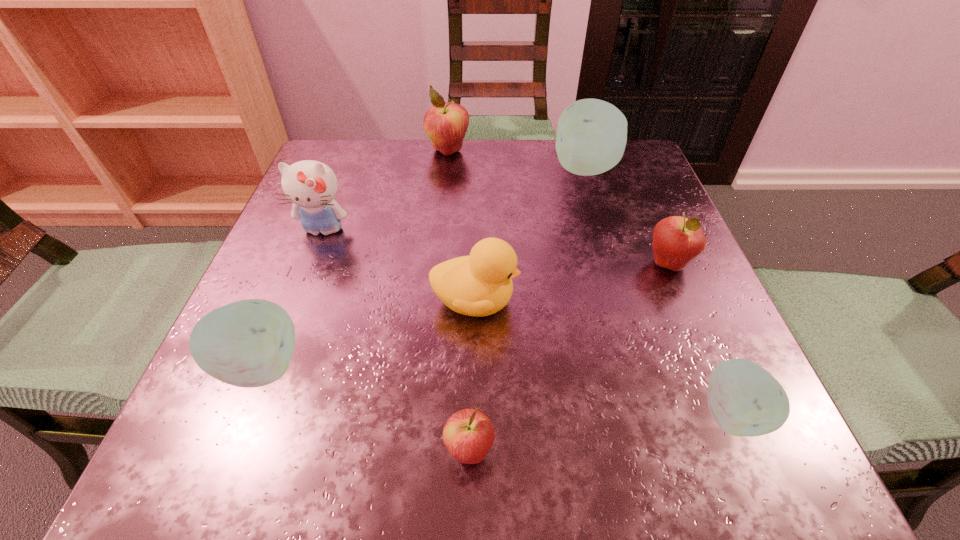
Where is `vacant space positioned on the front of the biggest red apple`? vacant space positioned on the front of the biggest red apple is located at coordinates (443, 212).

The width and height of the screenshot is (960, 540). What are the coordinates of `vacant space located on the left of the biggest white apple` in the screenshot? It's located at (449, 169).

The width and height of the screenshot is (960, 540). Identify the location of free spot located on the front-facing side of the sixth nearest object. (279, 345).

Find the location of `vacant space located on the front-facing side of the duck`. vacant space located on the front-facing side of the duck is located at coordinates (636, 302).

Locate an element on the screen. The height and width of the screenshot is (540, 960). vacant space situated on the back of the fourth nearest apple is located at coordinates (619, 146).

Identify the location of free space located 0.330m on the right of the leftmost white apple. This screenshot has height=540, width=960. (534, 367).

Locate an element on the screen. This screenshot has width=960, height=540. vacant space located 0.390m on the left of the smallest white apple is located at coordinates (396, 414).

At what (x,y) coordinates should I click in order to perform the action: click on vacant space located on the right of the smallest red apple. Please return your answer as a coordinate pair (x, y). The width and height of the screenshot is (960, 540). Looking at the image, I should click on (723, 451).

This screenshot has width=960, height=540. I want to click on kitten that is at the left edge, so click(311, 186).

Where is `apple that is at the left edge`? apple that is at the left edge is located at coordinates (249, 343).